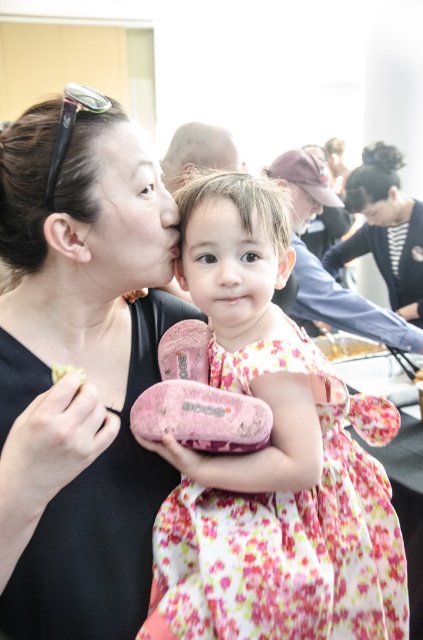
You are a photographer at the event and need to adjust the lighting to ensure both the black textured hair at upper center and the matte black hair at upper center are well lit. Based on their positions, which one is closer to the left side of the frame?

The black textured hair at upper center is closer to the left side of the frame since it is positioned to the left of the matte black hair at upper center.

You are a photographer at a social event and need to capture a photo of both the matte black dress at left and the pink fabric dress at center. Based on their positions, which dress is located to the right of the other?

The pink fabric dress at center is to the right of the matte black dress at left because the matte black dress at left is positioned on the left side of the pink fabric dress at center.